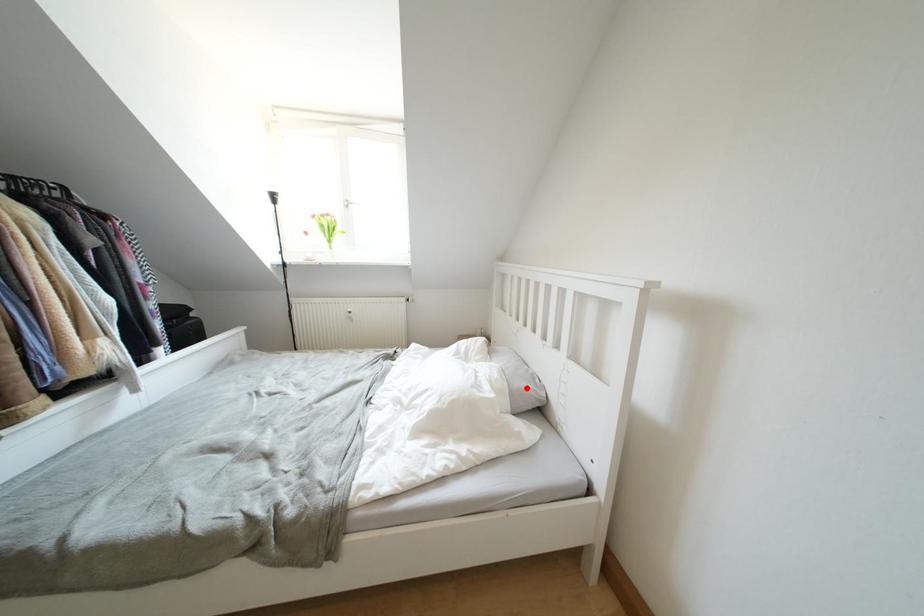
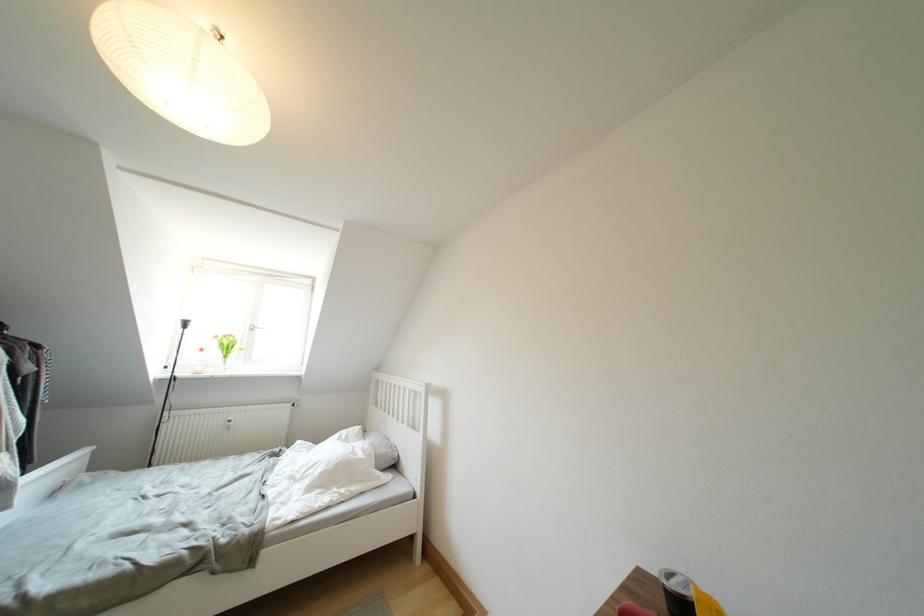
Question: I am providing you with two images of the same scene from different viewpoints. A red point is shown in image1. For the corresponding object point in image2, is it positioned nearer or farther from the camera?

Choices:
 (A) Nearer
 (B) Farther

Answer: (B)